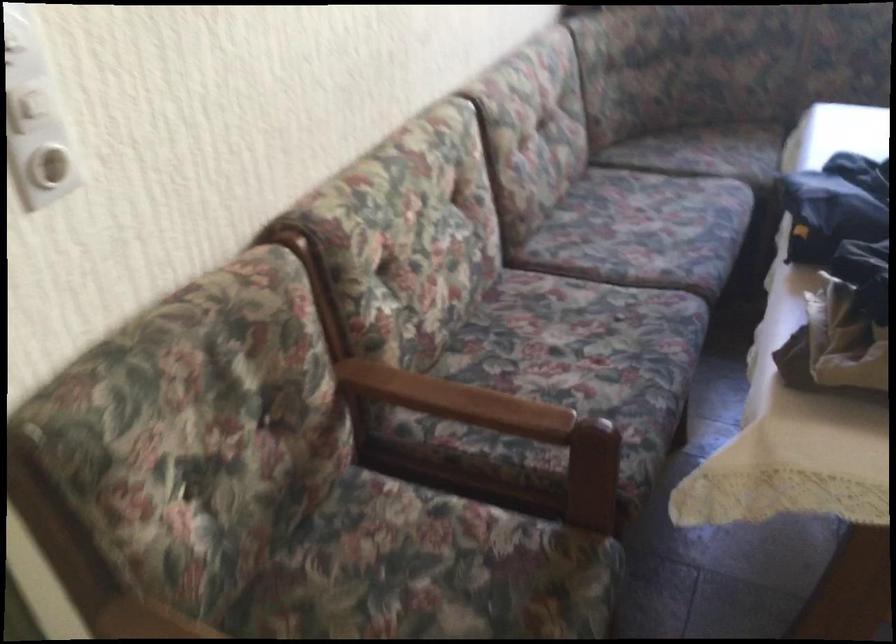
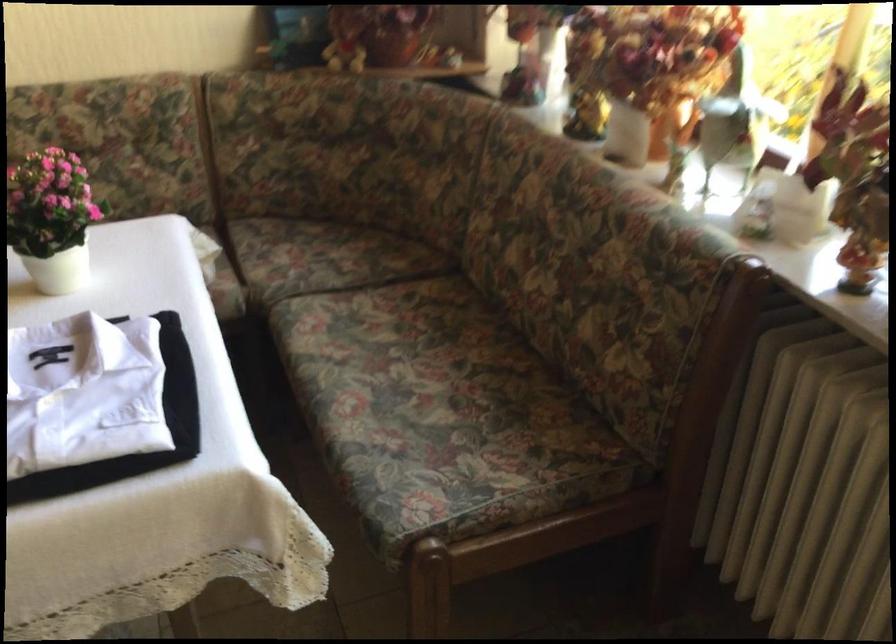
Find the pixel in the second image that matches point (700, 149) in the first image.

(306, 252)